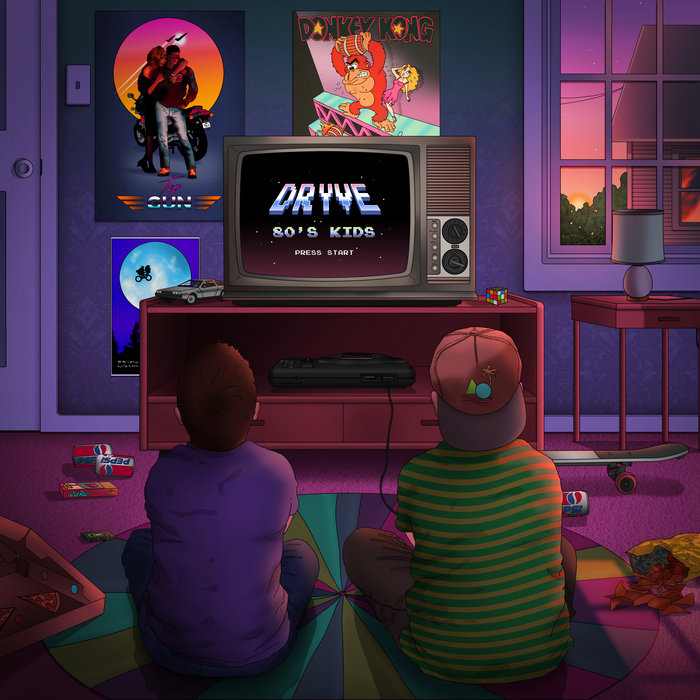
Where is `rug`? rug is located at coordinates (97, 654).